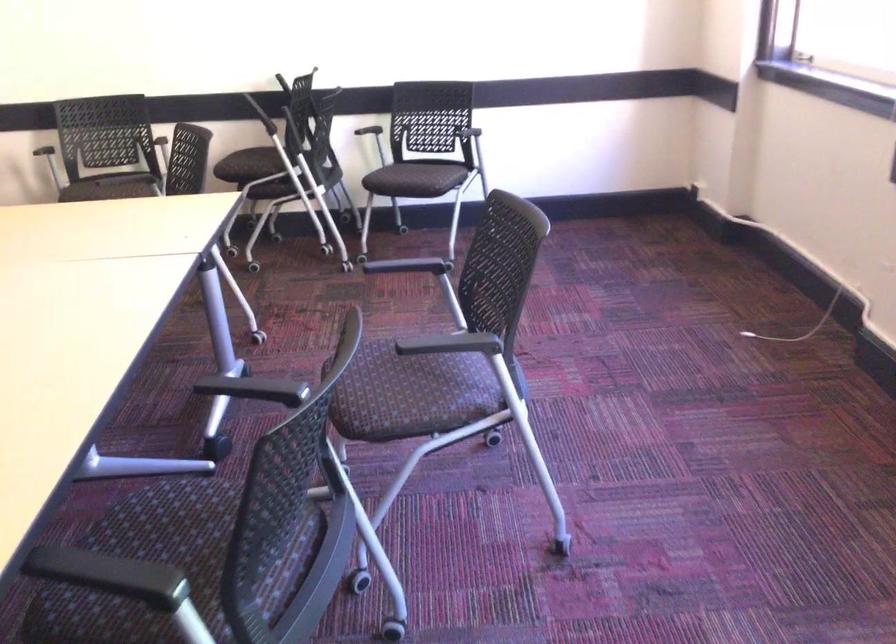
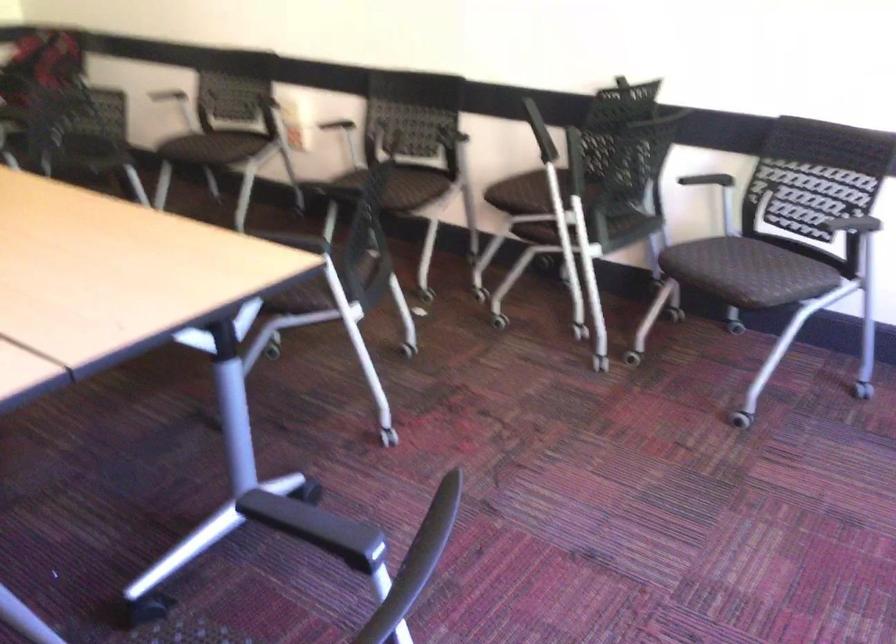
Where in the second image is the point corresponding to point (247, 160) from the first image?

(526, 193)